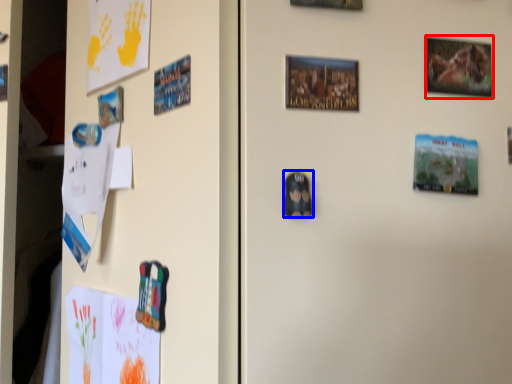
Question: Which object is further to the camera taking this photo, picture frame (highlighted by a red box) or print (highlighted by a blue box)?

Choices:
 (A) picture frame
 (B) print

Answer: (A)